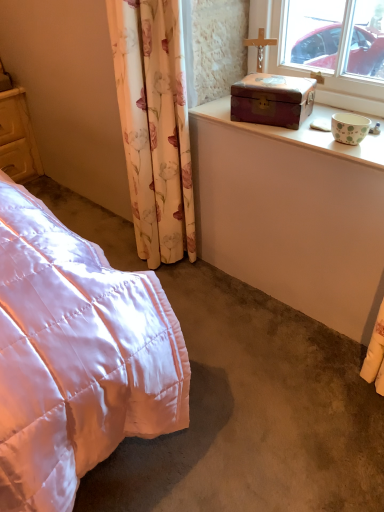
Question: In the image, is wooden box at upper right positioned in front of or behind floral fabric curtain at left?

Choices:
 (A) behind
 (B) front

Answer: (A)

Question: From the image's perspective, is wooden box at upper right positioned above or below floral fabric curtain at left?

Choices:
 (A) above
 (B) below

Answer: (A)

Question: Which is nearer to the wooden box at upper right?

Choices:
 (A) floral fabric curtain at left
 (B) matte yellow wooden cupboard at left
 (C) wooden chest at upper right

Answer: (C)

Question: Considering the real-world distances, which object is farthest from the wooden chest at upper right?

Choices:
 (A) matte yellow wooden cupboard at left
 (B) floral fabric curtain at left
 (C) wooden box at upper right

Answer: (A)